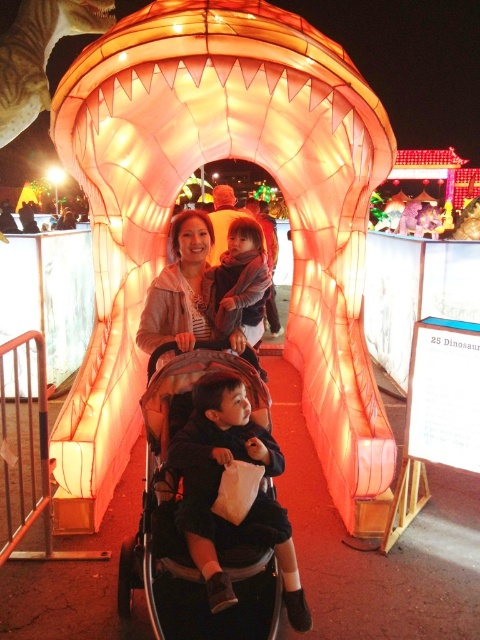
Is black fabric baby carriage at center positioned before matte gray stroller at center?

Yes, black fabric baby carriage at center is in front of matte gray stroller at center.

Who is taller, black fabric baby carriage at center or matte gray stroller at center?

With more height is black fabric baby carriage at center.

The height and width of the screenshot is (640, 480). Identify the location of black fabric baby carriage at center. (175, 524).

Does black fabric baby carriage at center appear over soft pink fabric baby at center?

No, black fabric baby carriage at center is not above soft pink fabric baby at center.

Is black fabric baby carriage at center below soft pink fabric baby at center?

Indeed, black fabric baby carriage at center is positioned under soft pink fabric baby at center.

What are the coordinates of `black fabric baby carriage at center` in the screenshot? It's located at (175, 524).

Does matte gray stroller at center have a greater width compared to soft pink fabric baby at center?

Indeed, matte gray stroller at center has a greater width compared to soft pink fabric baby at center.

How much distance is there between matte gray stroller at center and soft pink fabric baby at center?

A distance of 20.87 centimeters exists between matte gray stroller at center and soft pink fabric baby at center.

At what (x,y) coordinates should I click in order to perform the action: click on matte gray stroller at center. Please return your answer as a coordinate pair (x, y). This screenshot has height=640, width=480. Looking at the image, I should click on (194, 296).